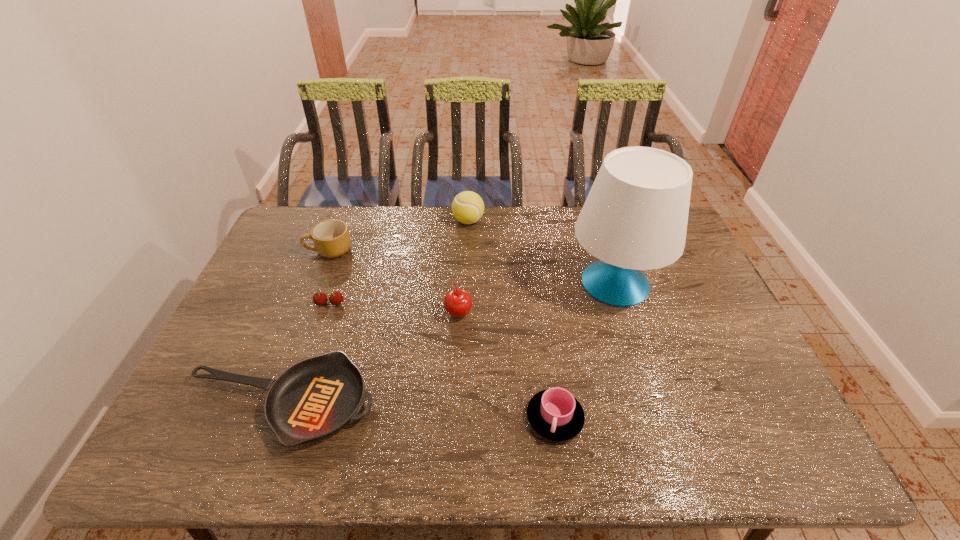
You are a GUI agent. You are given a task and a screenshot of the screen. Output one action in this format:
    pyautogui.click(x=<x>, y=<y>)
    Task: Click on the vacant position in the image that satisfies the following two spatial constraints: 1. on the surface of the right cherry; 2. on the left side of the left cherry
    The width and height of the screenshot is (960, 540).
    Given the screenshot: What is the action you would take?
    pyautogui.click(x=327, y=312)